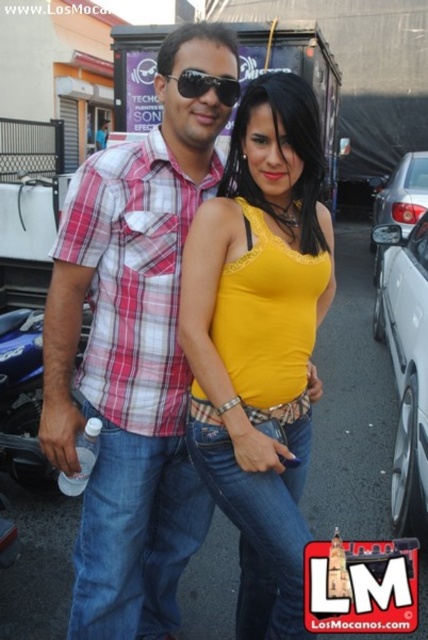
You are a photographer trying to capture a closeup of the yellow matte tank top at center. Based on its coordinates, where should you position your camera to ensure it is centered in the frame?

To center the yellow matte tank top at center in the frame, position your camera at the coordinates provided, which are point 0.533 on the x axis and 0.607 on the y axis.

What is the color of the clothing item located at the coordinates point [259,340]?

The yellow matte tank top at center is located at point [259,340], so the color is yellow.

You are taking a photo of two people standing near point (213, 467). The camera is 5.00 feet away from the point. If you want to include both people in the frame, will you need to zoom in or out?

Since the camera is 5.00 feet away from the point, you will need to zoom out to include both people in the frame.